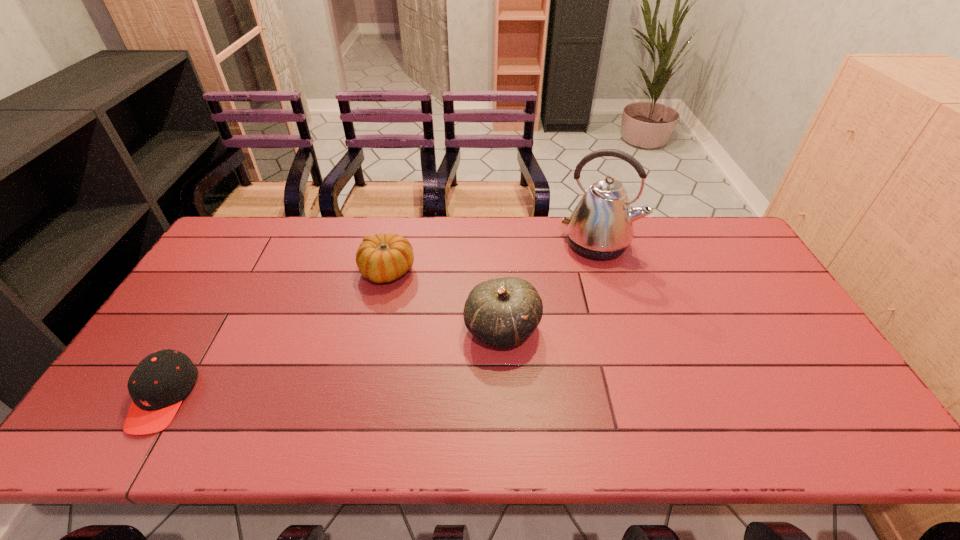
Locate an element on the screen. the third closest object to the right gourd is located at coordinates (158, 384).

Where is `object identified as the third closest to the rightmost object`? object identified as the third closest to the rightmost object is located at coordinates (158, 384).

The height and width of the screenshot is (540, 960). I want to click on blank area in the image that satisfies the following two spatial constraints: 1. on the back side of the rightmost object; 2. on the right side of the shorter gourd, so click(394, 244).

This screenshot has width=960, height=540. I want to click on vacant space that satisfies the following two spatial constraints: 1. on the front side of the third farthest object; 2. on the right side of the farther gourd, so click(373, 329).